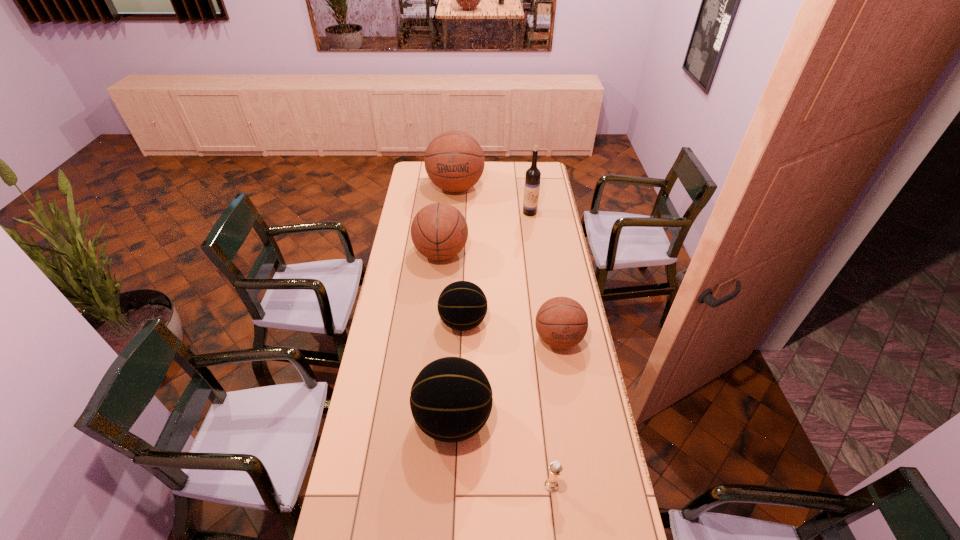
Identify the location of object at the far edge. (454, 160).

You are a GUI agent. You are given a task and a screenshot of the screen. Output one action in this format:
    pyautogui.click(x=<x>, y=<y>)
    Task: Click on the wine bottle at the right edge
    
    Given the screenshot: What is the action you would take?
    pyautogui.click(x=532, y=178)

Image resolution: width=960 pixels, height=540 pixels. Find the location of `basketball that is at the right edge`. basketball that is at the right edge is located at coordinates (561, 322).

Locate an element on the screen. This screenshot has width=960, height=540. object that is at the far left corner is located at coordinates (454, 160).

Locate an element on the screen. free space at the left edge is located at coordinates (396, 294).

In the image, there is a desktop. Identify the location of vacant space at the right edge. (559, 393).

Where is `free space at the far left corner`? Image resolution: width=960 pixels, height=540 pixels. free space at the far left corner is located at coordinates (421, 177).

This screenshot has height=540, width=960. What are the coordinates of `vacant area that lies between the shortest object and the fifth nearest object` in the screenshot? It's located at (496, 369).

Image resolution: width=960 pixels, height=540 pixels. In order to click on free space between the shortest object and the second farthest basketball in this screenshot , I will do `click(496, 369)`.

Image resolution: width=960 pixels, height=540 pixels. What are the coordinates of `blank region between the farthest brown basketball and the black wine bottle` in the screenshot? It's located at (492, 200).